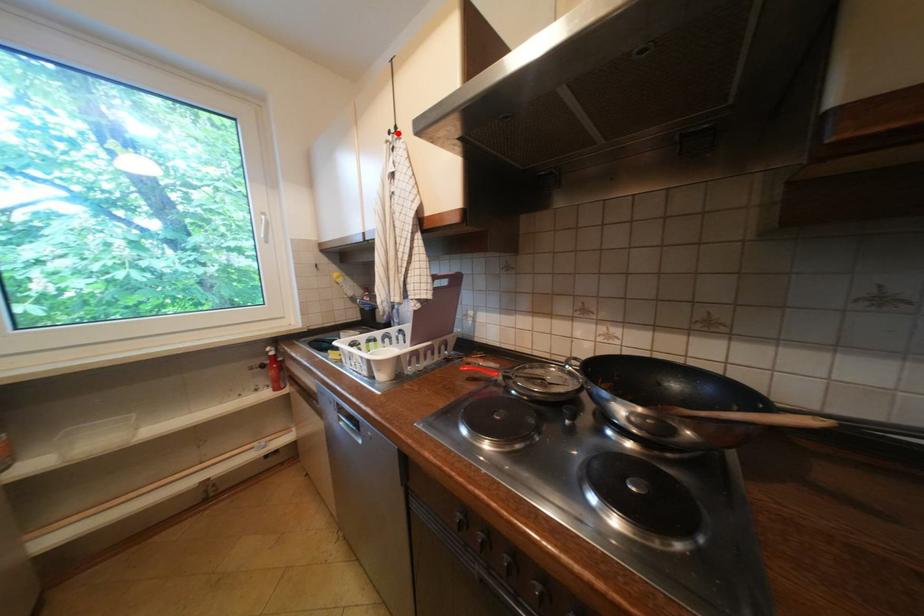
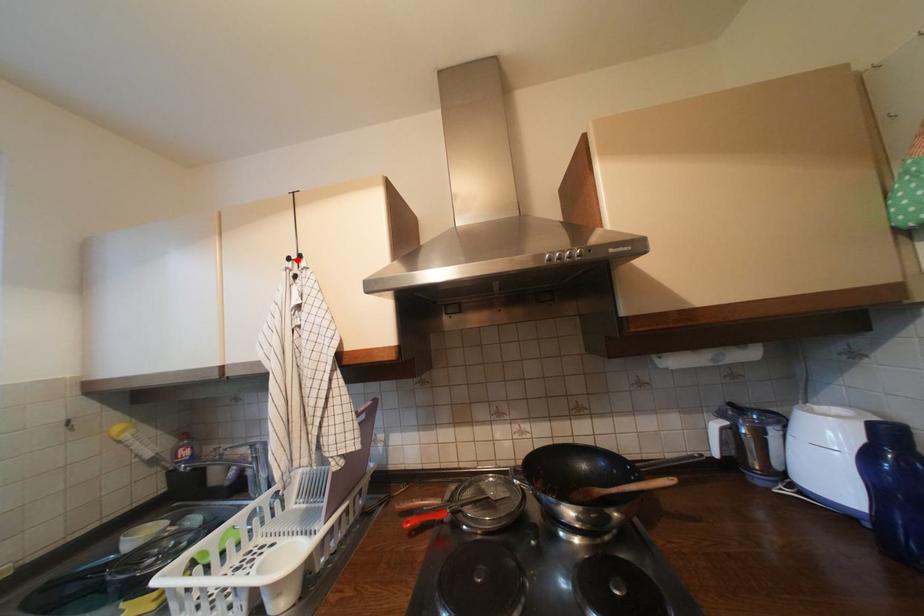
I am providing you with two images of the same scene from different viewpoints. A red point is marked on the first image and another point is marked on the second image. Are the points marked in image1 and image2 representing the same 3D position?

Yes